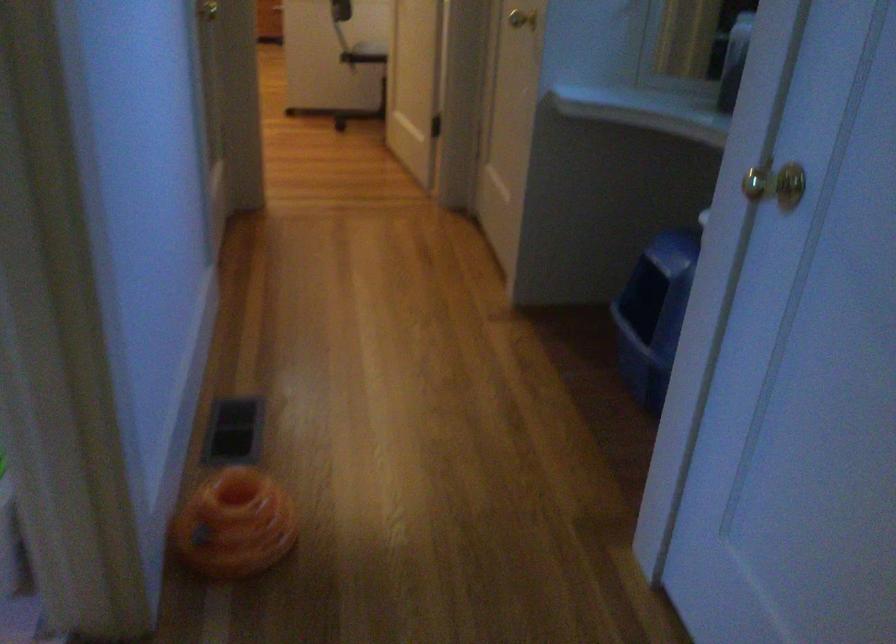
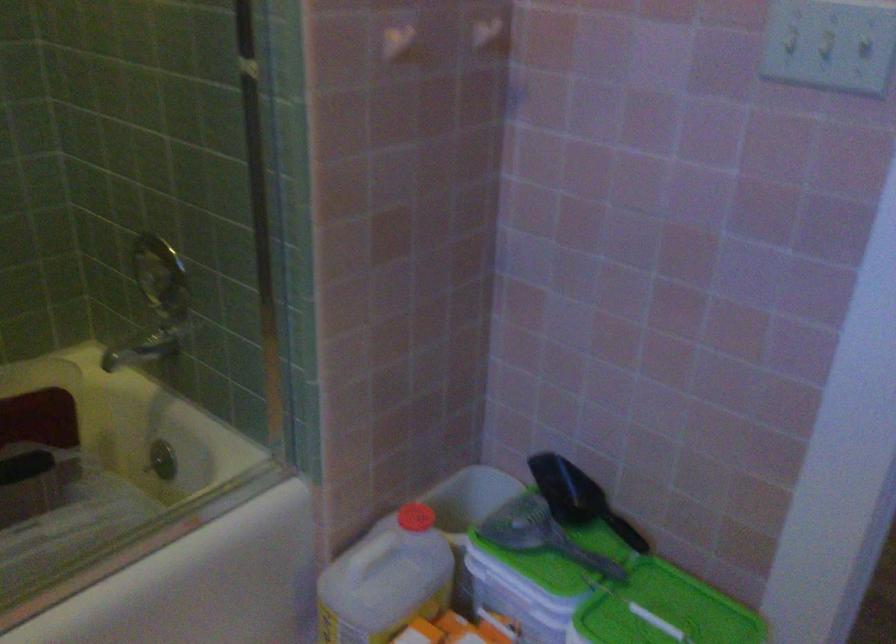
Question: I am providing you with two images of the same scene from different viewpoints. Please identify which objects are invisible in image2.

Choices:
 (A) black scoop handle
 (B) gold doorknob
 (C) shower faucet handle
 (D) silver toilet handle

Answer: (B)